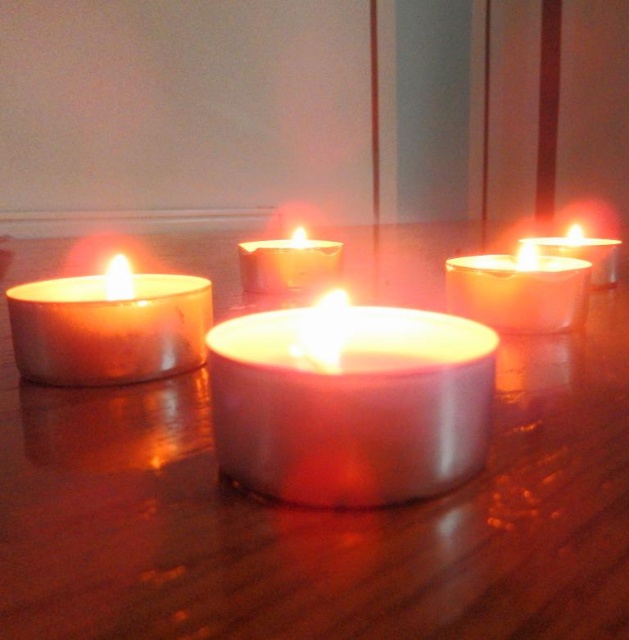
Between point (331, 440) and point (533, 237), which one is positioned in front?

Point (331, 440)

The height and width of the screenshot is (640, 629). What do you see at coordinates (350, 403) in the screenshot?
I see `satin white candle at center` at bounding box center [350, 403].

Locate an element on the screen. This screenshot has height=640, width=629. satin white candle at center is located at coordinates (350, 403).

Can you confirm if matte white candle at upper right is taller than matte white candle at right?

Yes, matte white candle at upper right is taller than matte white candle at right.

The image size is (629, 640). Describe the element at coordinates (520, 291) in the screenshot. I see `matte white candle at upper right` at that location.

Locate an element on the screen. Image resolution: width=629 pixels, height=640 pixels. matte white candle at upper right is located at coordinates (520, 291).

Between point (186, 324) and point (615, 269), which one is positioned in front?

Positioned in front is point (186, 324).

Between matte silver candle at left and matte white candle at right, which one has less height?

With less height is matte silver candle at left.

Does point (152, 378) come farther from viewer compared to point (604, 240)?

No.

The width and height of the screenshot is (629, 640). I want to click on matte silver candle at left, so click(x=108, y=326).